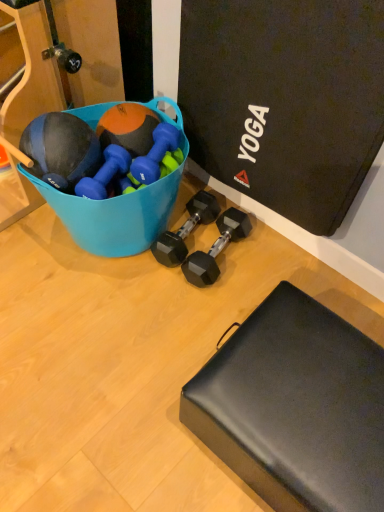
Question: In the image, is black matte footrest at lower right positioned in front of or behind blue rubber dumbbell at center, which appears as the 3th dumbbell when viewed from the right?

Choices:
 (A) front
 (B) behind

Answer: (A)

Question: From the image's perspective, is black matte footrest at lower right above or below blue rubber dumbbell at center, which appears as the 3th dumbbell when viewed from the right?

Choices:
 (A) above
 (B) below

Answer: (B)

Question: Which object is the closest to the blue plastic bucket at upper left?

Choices:
 (A) black rubber dumbbell at center, arranged as the 2th dumbbell when viewed from the right
 (B) black rubber dumbbell at center, marked as the first dumbbell in a right-to-left arrangement
 (C) blue rubber dumbbell at center, which ranks as the first dumbbell in left-to-right order
 (D) blue rubber dumbbell at center, which appears as the 3th dumbbell when viewed from the right
 (E) orange matte medicine ball at upper left

Answer: (C)

Question: Which is farther from the black rubber dumbbell at center, which ranks as the third dumbbell in left-to-right order?

Choices:
 (A) blue plastic bucket at upper left
 (B) blue rubber dumbbell at center, which is counted as the fourth dumbbell, starting from the right
 (C) blue rubber dumbbell at center, which appears as the 3th dumbbell when viewed from the right
 (D) black matte footrest at lower right
 (E) black rubber dumbbell at center, which is the 4th dumbbell in left-to-right order

Answer: (D)